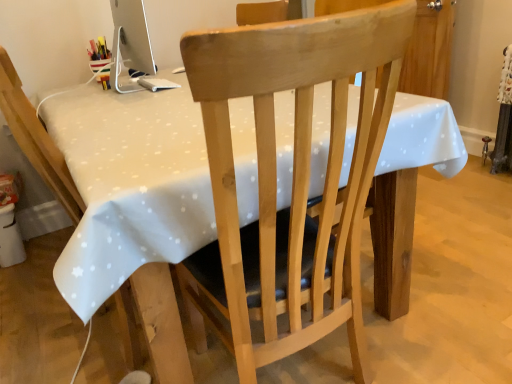
Find the location of `free space in front of white glossy computer monitor at upper left`. free space in front of white glossy computer monitor at upper left is located at coordinates (139, 102).